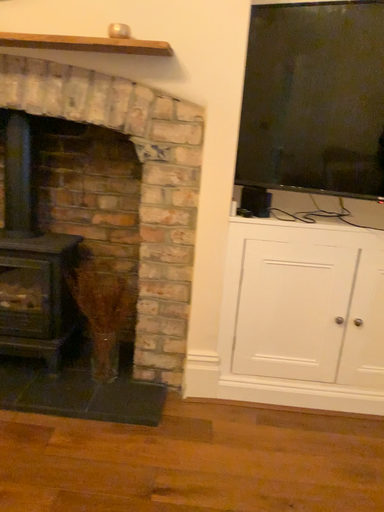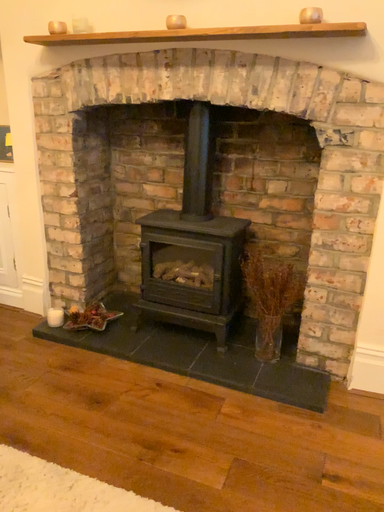
Question: How did the camera likely rotate when shooting the video?

Choices:
 (A) rotated left
 (B) rotated right

Answer: (A)